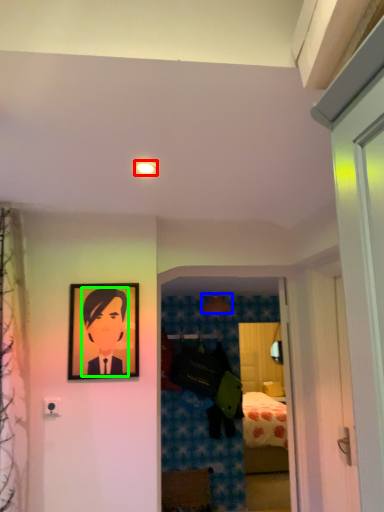
Question: Estimate the real-world distances between objects in this image. Which object is farther from lighting (highlighted by a red box), lamp (highlighted by a blue box) or person (highlighted by a green box)?

Choices:
 (A) lamp
 (B) person

Answer: (A)